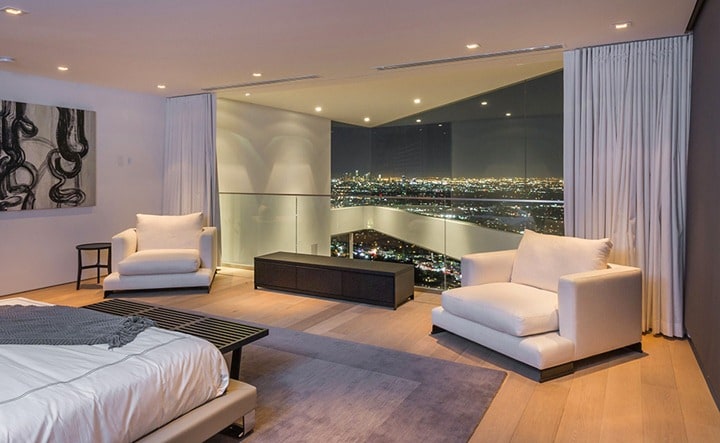
Where is `lights`? This screenshot has width=720, height=443. lights is located at coordinates (415, 96).